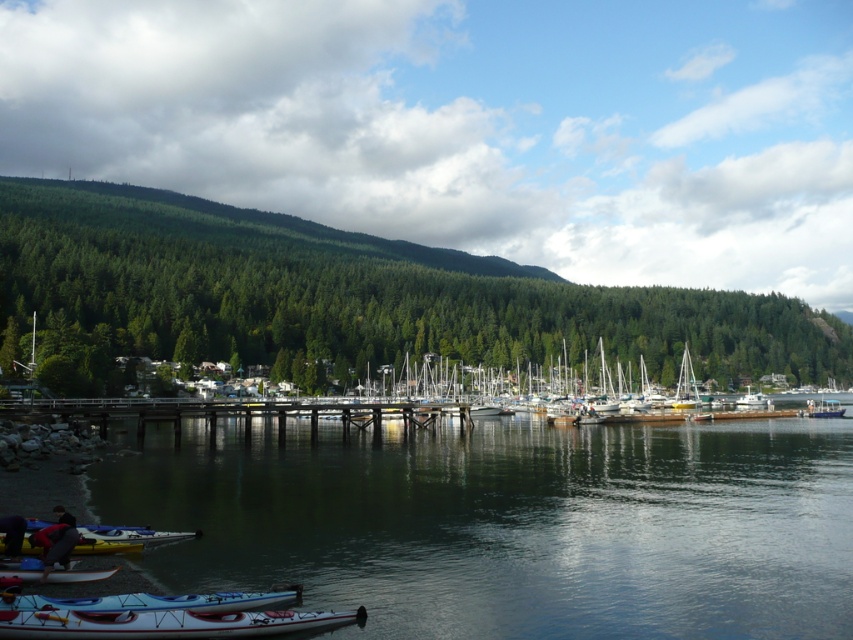
Question: Which object appears farthest from the camera in this image?

Choices:
 (A) green matte forest at upper left
 (B) white plastic boat at center

Answer: (B)

Question: Does yellow kayak at lower left appear under white plastic canoe at lower left?

Choices:
 (A) yes
 (B) no

Answer: (B)

Question: Does green matte forest at upper left have a smaller size compared to white plastic canoe at lower left?

Choices:
 (A) no
 (B) yes

Answer: (A)

Question: Which of these objects is positioned closest to the white plastic canoe at lower left?

Choices:
 (A) green matte forest at upper left
 (B) clear water at lower left

Answer: (B)

Question: Can you confirm if green matte forest at upper left is positioned to the right of white glossy canoe at lower center?

Choices:
 (A) yes
 (B) no

Answer: (A)

Question: Which object appears closest to the camera in this image?

Choices:
 (A) green matte forest at upper left
 (B) white glossy canoe at lower center
 (C) white plastic boat at center
 (D) clear water at lower left

Answer: (B)